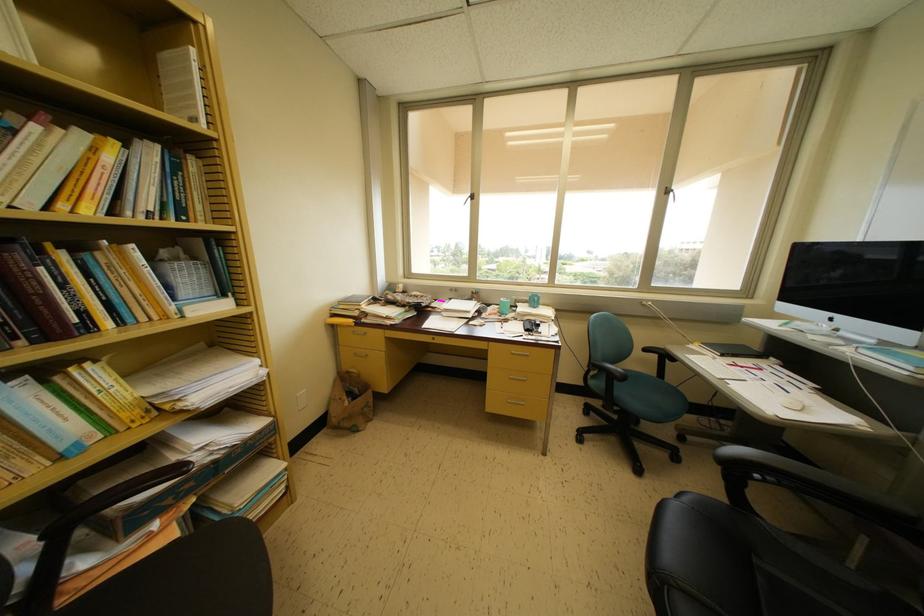
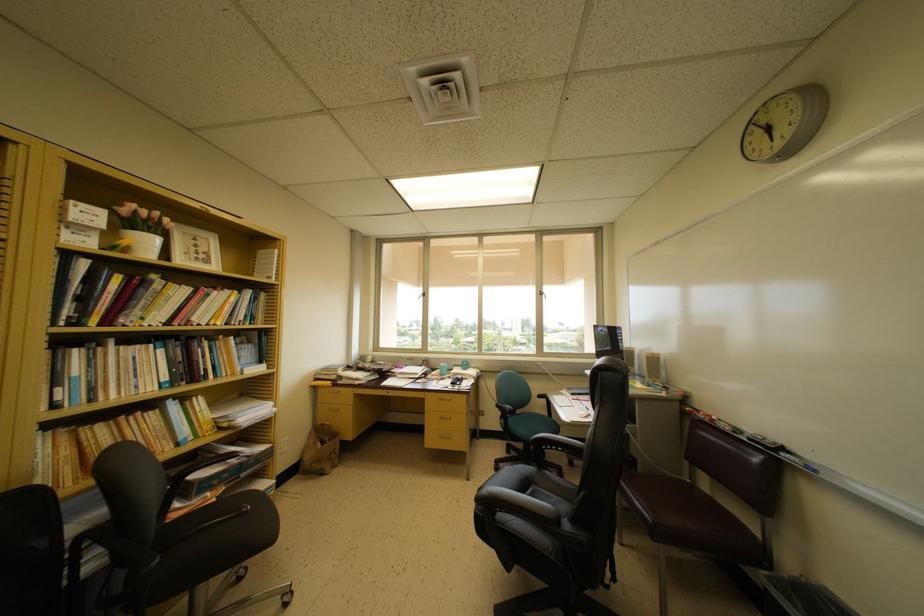
Where in the second image is the point corresponding to [671,193] from the first image?

(543, 297)